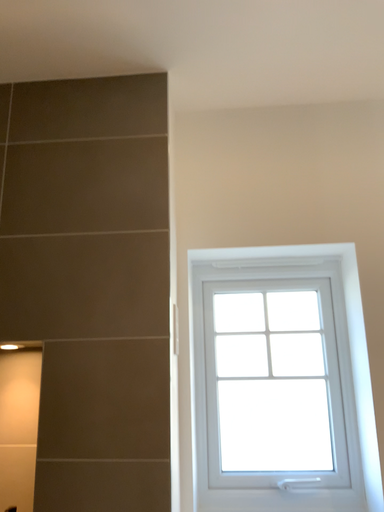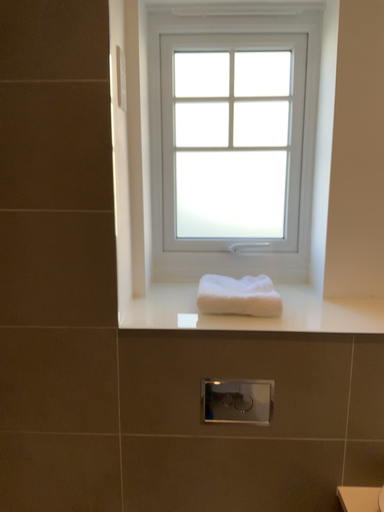
Question: How did the camera likely rotate when shooting the video?

Choices:
 (A) rotated upward
 (B) rotated downward

Answer: (B)